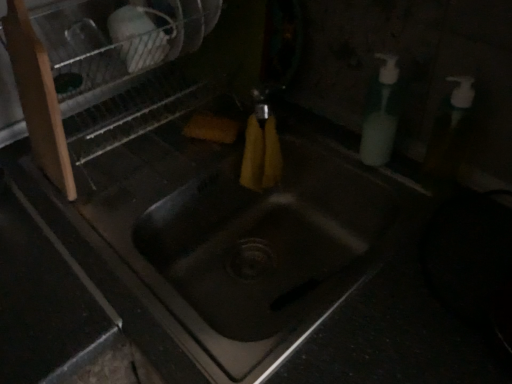
Describe the element at coordinates (89, 61) in the screenshot. I see `metallic silver dish rack at upper left` at that location.

In order to face metallic silver dish rack at upper left, should I rotate leftwards or rightwards?

Rotate your view left by about 17.991°.

The width and height of the screenshot is (512, 384). Identify the location of metallic silver dish rack at upper left. (89, 61).

What is the approximate width of white plastic soap dispenser at right?

white plastic soap dispenser at right is 5.98 centimeters wide.

Describe the element at coordinates (381, 114) in the screenshot. I see `white plastic soap dispenser at right` at that location.

This screenshot has width=512, height=384. Identify the location of white plastic soap dispenser at right. (381, 114).

Image resolution: width=512 pixels, height=384 pixels. I want to click on metallic silver dish rack at upper left, so click(89, 61).

In the image, is metallic silver dish rack at upper left on the left side or the right side of white plastic soap dispenser at right?

From the image, it's evident that metallic silver dish rack at upper left is to the left of white plastic soap dispenser at right.

Which is in front, metallic silver dish rack at upper left or white plastic soap dispenser at right?

metallic silver dish rack at upper left is more forward.

Which is nearer, (33, 65) or (371, 141)?

The point (33, 65) is in front.

From the image's perspective, which object appears higher, metallic silver dish rack at upper left or white plastic soap dispenser at right?

metallic silver dish rack at upper left, from the image's perspective.

From a real-world perspective, is metallic silver dish rack at upper left positioned above or below white plastic soap dispenser at right?

metallic silver dish rack at upper left is situated higher than white plastic soap dispenser at right in the real world.

Which of these two, metallic silver dish rack at upper left or white plastic soap dispenser at right, is thinner?

white plastic soap dispenser at right.

Considering the sizes of objects metallic silver dish rack at upper left and white plastic soap dispenser at right in the image provided, who is shorter, metallic silver dish rack at upper left or white plastic soap dispenser at right?

With less height is white plastic soap dispenser at right.

Between metallic silver dish rack at upper left and white plastic soap dispenser at right, which one has smaller size?

white plastic soap dispenser at right.

In the scene shown: Is metallic silver dish rack at upper left outside of white plastic soap dispenser at right?

Indeed, metallic silver dish rack at upper left is completely outside white plastic soap dispenser at right.

Is metallic silver dish rack at upper left positioned far away from white plastic soap dispenser at right?

No, metallic silver dish rack at upper left is in close proximity to white plastic soap dispenser at right.

Looking at this image, does metallic silver dish rack at upper left turn towards white plastic soap dispenser at right?

No, metallic silver dish rack at upper left does not turn towards white plastic soap dispenser at right.

Can you tell me how much metallic silver dish rack at upper left and white plastic soap dispenser at right differ in facing direction?

They differ by 0.00202 degrees in their facing directions.

At what (x,y) coordinates should I click in order to perform the action: click on soap dispenser that appears below the metallic silver dish rack at upper left (from a real-world perspective). Please return your answer as a coordinate pair (x, y). This screenshot has width=512, height=384. Looking at the image, I should click on (381, 114).

Which is more to the left, white plastic soap dispenser at right or metallic silver dish rack at upper left?

Positioned to the left is metallic silver dish rack at upper left.

Which object is further away from the camera, white plastic soap dispenser at right or metallic silver dish rack at upper left?

white plastic soap dispenser at right is further from the camera.

Which is closer, (387, 122) or (104, 14)?

The point (387, 122) is closer.

From the image's perspective, which is below, white plastic soap dispenser at right or metallic silver dish rack at upper left?

white plastic soap dispenser at right is shown below in the image.

From a real-world perspective, is white plastic soap dispenser at right under metallic silver dish rack at upper left?

Correct, in the physical world, white plastic soap dispenser at right is lower than metallic silver dish rack at upper left.

Considering the sizes of objects white plastic soap dispenser at right and metallic silver dish rack at upper left in the image provided, who is thinner, white plastic soap dispenser at right or metallic silver dish rack at upper left?

Thinner between the two is white plastic soap dispenser at right.

Which of these two, white plastic soap dispenser at right or metallic silver dish rack at upper left, stands shorter?

With less height is white plastic soap dispenser at right.

Is white plastic soap dispenser at right bigger than metallic silver dish rack at upper left?

No.

Is metallic silver dish rack at upper left a part of white plastic soap dispenser at right?

No, metallic silver dish rack at upper left is not surrounded by white plastic soap dispenser at right.

Is white plastic soap dispenser at right next to metallic silver dish rack at upper left?

white plastic soap dispenser at right is not next to metallic silver dish rack at upper left, and they're not touching.

Is white plastic soap dispenser at right facing towards metallic silver dish rack at upper left?

No.

How many degrees apart are the facing directions of white plastic soap dispenser at right and metallic silver dish rack at upper left?

They differ by 0.00202 degrees in their facing directions.

Where is `dish washer above the white plastic soap dispenser at right (from the image's perspective)`? This screenshot has height=384, width=512. dish washer above the white plastic soap dispenser at right (from the image's perspective) is located at coordinates (89, 61).

The height and width of the screenshot is (384, 512). Identify the location of soap dispenser on the right of metallic silver dish rack at upper left. (381, 114).

Identify the location of soap dispenser below the metallic silver dish rack at upper left (from the image's perspective). The height and width of the screenshot is (384, 512). (381, 114).